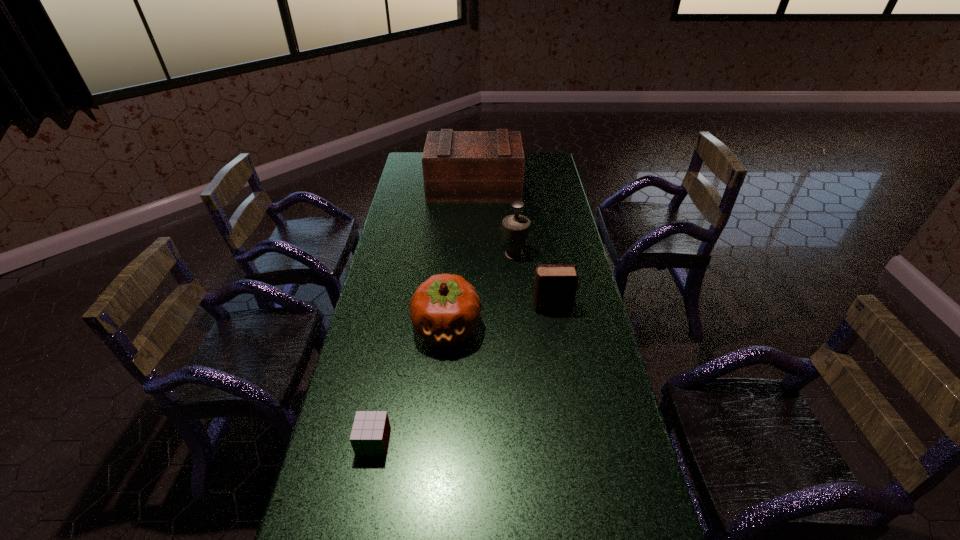
Where is `vacant point located between the fourth nearest object and the farthest object`? Image resolution: width=960 pixels, height=540 pixels. vacant point located between the fourth nearest object and the farthest object is located at coordinates (494, 221).

Identify the location of free space that is in between the pumpkin and the diary. The width and height of the screenshot is (960, 540). (499, 318).

Where is `empty location between the shortest object and the pumpkin`? empty location between the shortest object and the pumpkin is located at coordinates (410, 384).

Locate an element on the screen. The image size is (960, 540). the third closest object relative to the pumpkin is located at coordinates point(370,433).

Choose which object is the nearest neighbor to the nearest object. Please provide its 2D coordinates. Your answer should be formatted as a tuple, i.e. [(x, y)], where the tuple contains the x and y coordinates of a point satisfying the conditions above.

[(445, 309)]

Where is `blank space that satisfies the following two spatial constraints: 1. on the spine side of the diary; 2. on the side of the pumpkin with the cute face`? This screenshot has height=540, width=960. blank space that satisfies the following two spatial constraints: 1. on the spine side of the diary; 2. on the side of the pumpkin with the cute face is located at coordinates (555, 327).